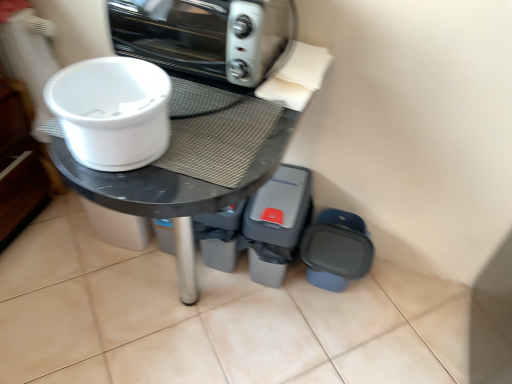
Find the location of a particular element. free space between matte black table at center and matte plastic container at lower right, the first appliance from the right is located at coordinates (287, 335).